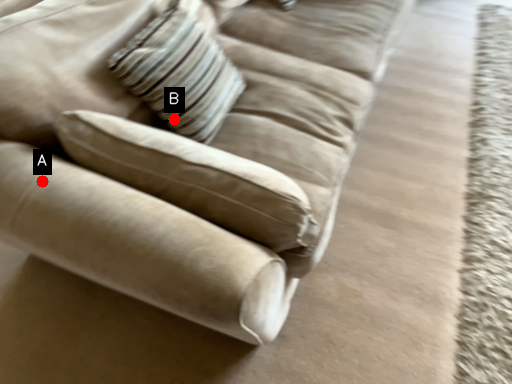
Question: Two points are circled on the image, labeled by A and B beside each circle. Which point is farther to the camera?

Choices:
 (A) A is further
 (B) B is further

Answer: (B)